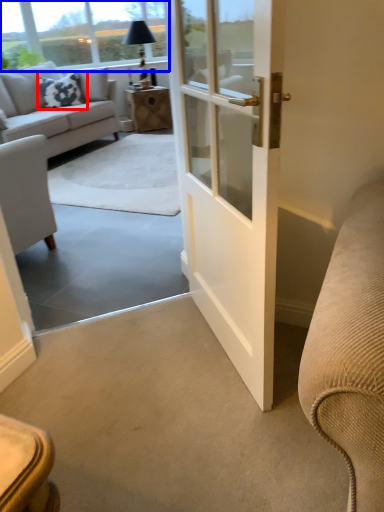
Question: Which of the following is the farthest to the observer, pillow (highlighted by a red box) or window screen (highlighted by a blue box)?

Choices:
 (A) pillow
 (B) window screen

Answer: (B)